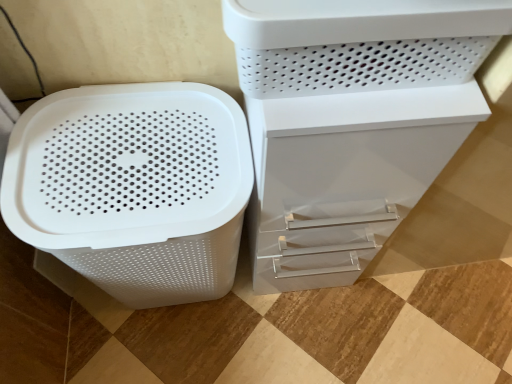
Question: Relative to white plastic container at upper right, is white plastic file cabinet at center in front or behind?

Choices:
 (A) behind
 (B) front

Answer: (A)

Question: From the image's perspective, is white plastic file cabinet at center positioned above or below white plastic container at upper right?

Choices:
 (A) below
 (B) above

Answer: (A)

Question: Which object is the farthest from the white matte plastic basket at left?

Choices:
 (A) white plastic file cabinet at center
 (B) white plastic container at upper right

Answer: (B)

Question: Based on their relative distances, which object is farther from the white plastic container at upper right?

Choices:
 (A) white matte plastic basket at left
 (B) white plastic file cabinet at center

Answer: (A)